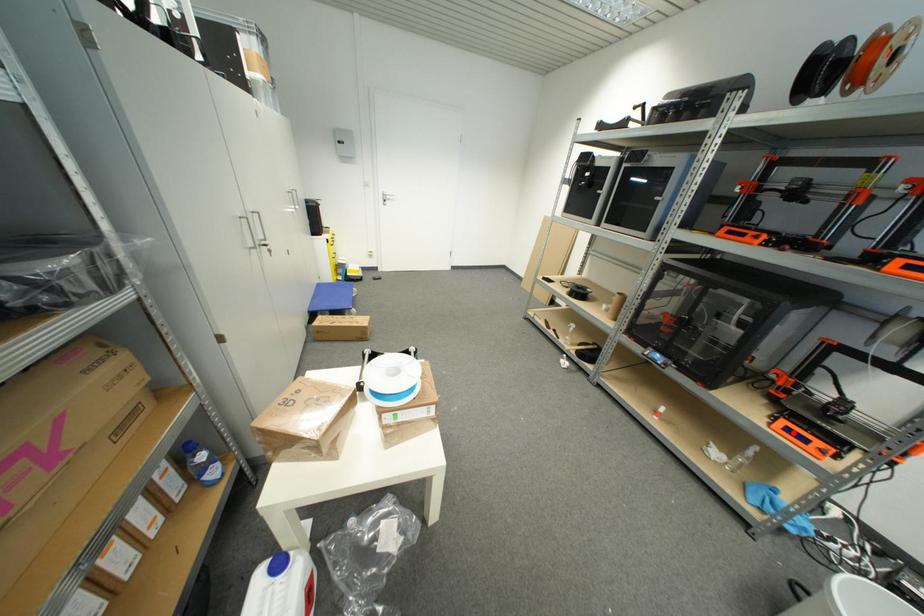
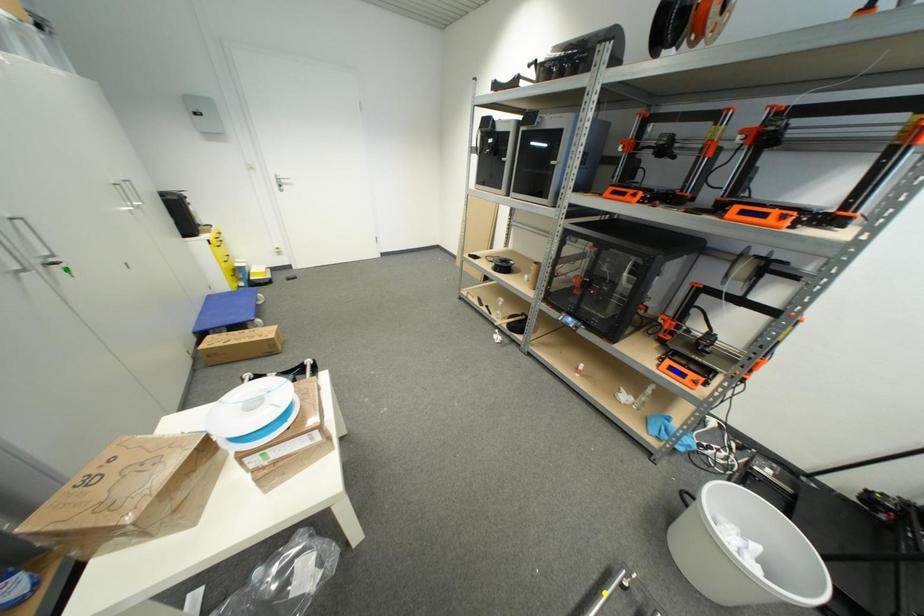
Question: I am providing you with two images of the same scene from different viewpoints. A red point is marked on the first image. You are given multiple points on the second image. Which point in image 2 represents the same 3d spot as the red point in image 1?

Choices:
 (A) yellow point
 (B) green point
 (C) blue point

Answer: (C)